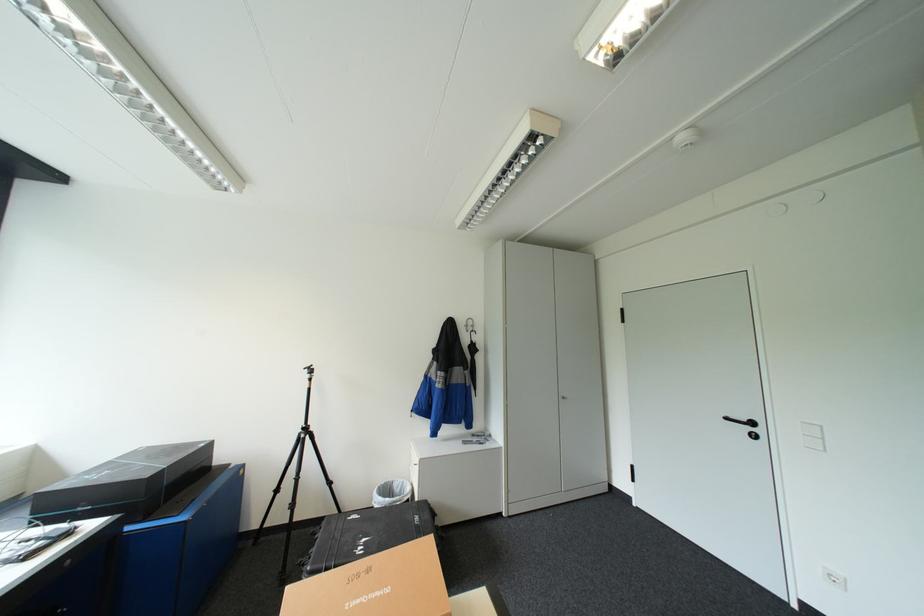
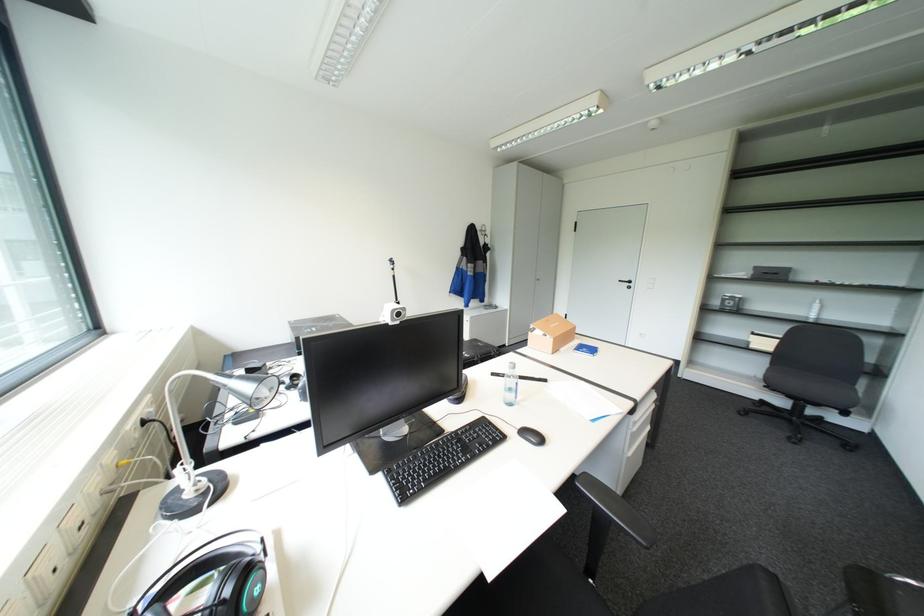
Which direction would the cameraman need to move to produce the second image?

The movement direction of the cameraman is left, backward.